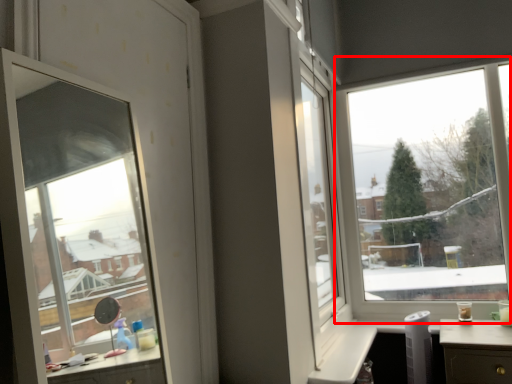
Question: Considering the relative positions of window (annotated by the red box) and window in the image provided, where is window (annotated by the red box) located with respect to the staircase?

Choices:
 (A) right
 (B) left

Answer: (A)